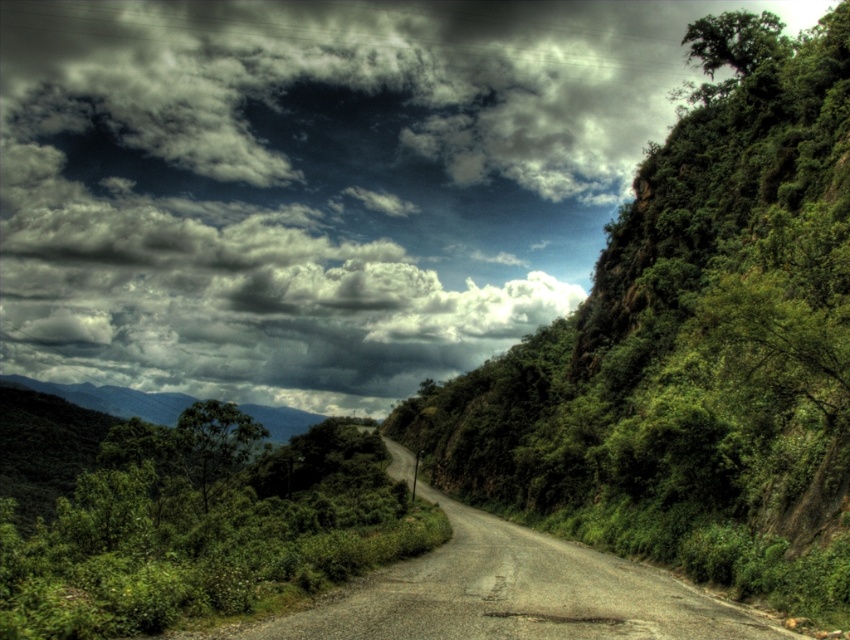
You are driving a car and see the cloudy sky at upper center and the gravel road at center ahead. Which object will appear closer to you as you move forward?

The cloudy sky at upper center will appear closer because the gravel road at center is positioned behind it, meaning the sky is in the foreground relative to the road.

You are a photographer planning to capture the cloudy sky at upper center and the green leafy shrubs at center in a single frame. Based on the scene, which object will occupy more space in your photo?

The cloudy sky at upper center will occupy more space in the photo because it is larger in size than the green leafy shrubs at center.